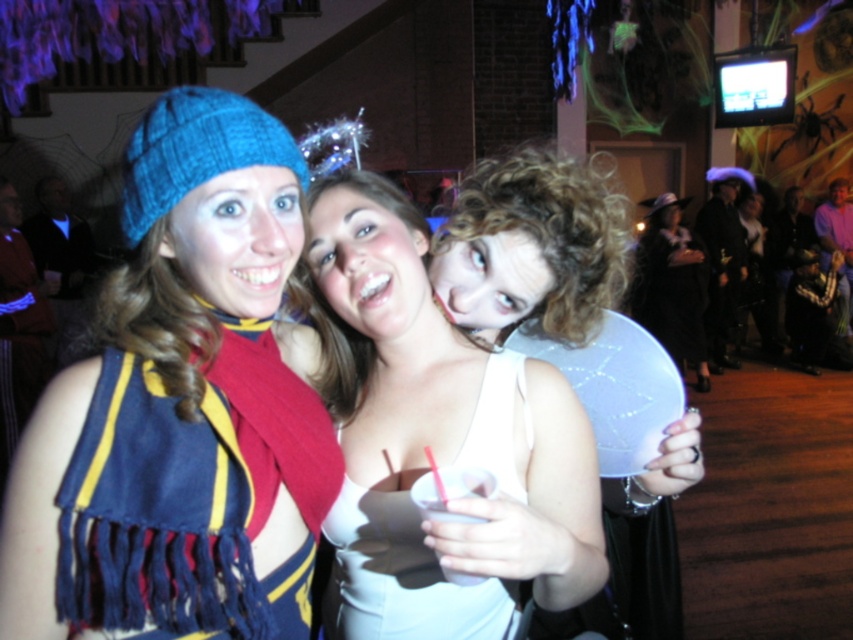
You are a photographer at the party and want to capture a photo of the curly hair at center and the white matte dress at center. Based on their positions, which one is located higher in the frame?

The curly hair at center is above the white matte dress at center, so it is higher in the frame.

You are planning to hang a decorative banner that is 1 meter wide in the center of the room. Considering the white matte wings at center and the white matte dress at center, which one might block the banner from being fully visible?

The white matte wings at center might be wider than the white matte dress at center, so they could block the banner from being fully visible.